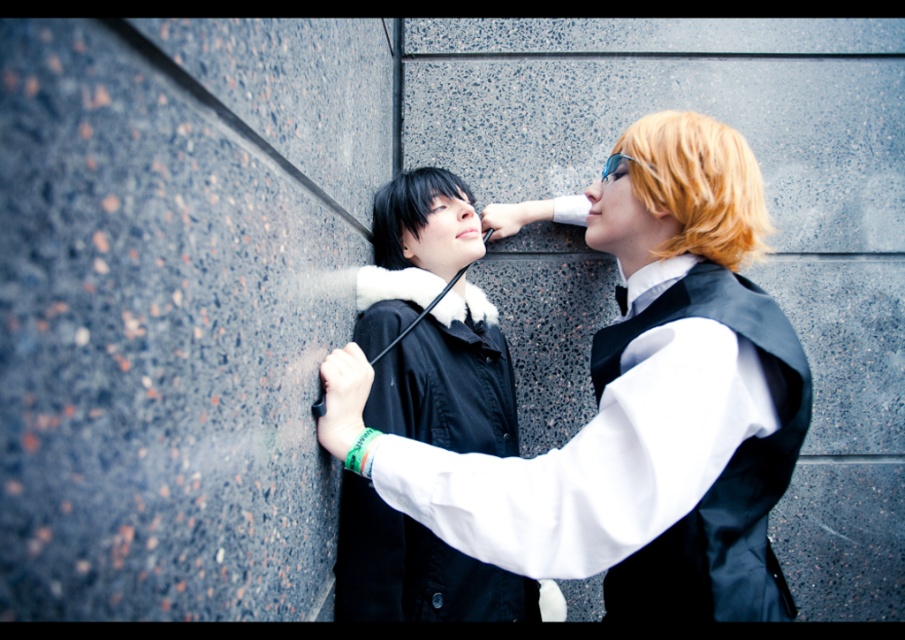
Who is positioned more to the right, matte black jacket at center or clear plastic goggles at upper center?

matte black jacket at center

Does point (557, 508) come behind point (611, 170)?

No, (557, 508) is closer to viewer.

Describe the element at coordinates (635, 403) in the screenshot. I see `matte black jacket at center` at that location.

Identify the location of matte black jacket at center. This screenshot has width=905, height=640. (635, 403).

Is black matte hair at center to the right of clear plastic goggles at upper center from the viewer's perspective?

In fact, black matte hair at center is to the left of clear plastic goggles at upper center.

Can you confirm if black matte hair at center is thinner than clear plastic goggles at upper center?

Incorrect, black matte hair at center's width is not less than clear plastic goggles at upper center's.

Which is in front, point (380, 256) or point (621, 157)?

Point (621, 157) is more forward.

Find the location of a particular element. This screenshot has height=640, width=905. black matte hair at center is located at coordinates (408, 209).

Is point (414, 173) farther from viewer compared to point (592, 182)?

Yes, it is behind point (592, 182).

Between black matte hair at center and sleek plastic nose at center, which one appears on the left side from the viewer's perspective?

From the viewer's perspective, black matte hair at center appears more on the left side.

Which is behind, point (421, 225) or point (601, 195)?

Point (421, 225)

Where is `black matte hair at center`? black matte hair at center is located at coordinates (408, 209).